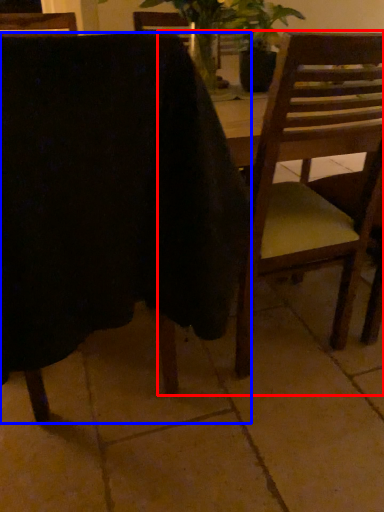
Question: Among these objects, which one is nearest to the camera, chair (highlighted by a red box) or chair (highlighted by a blue box)?

Choices:
 (A) chair
 (B) chair

Answer: (B)